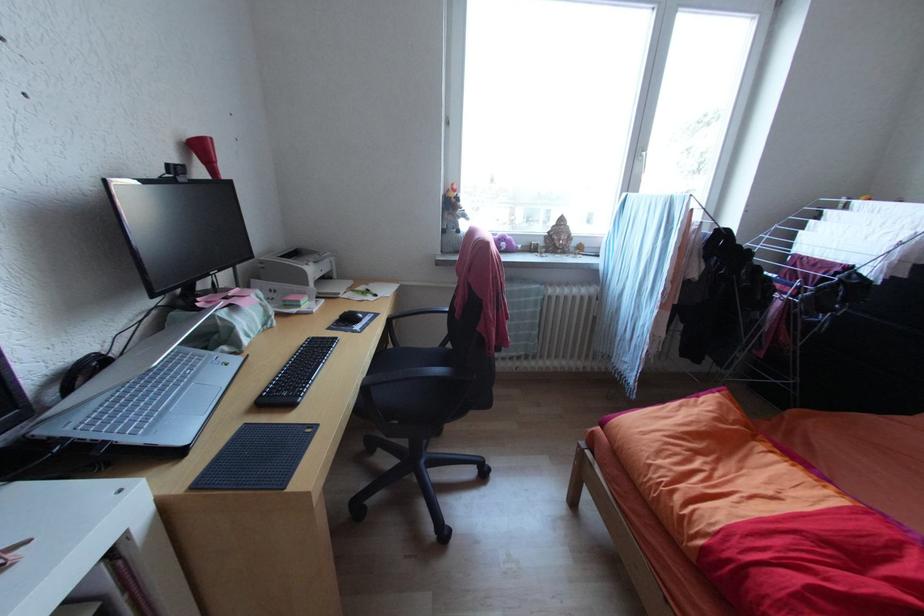
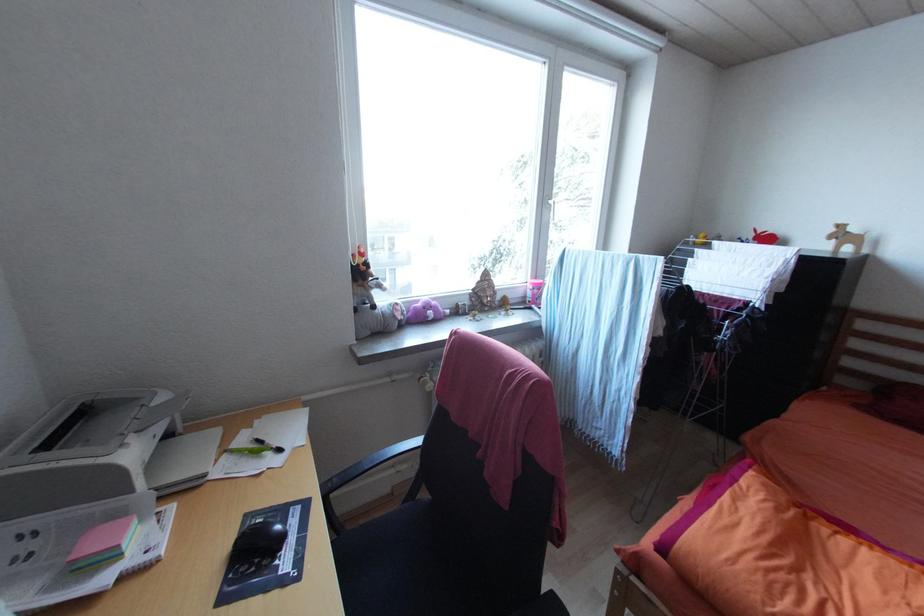
Question: The camera is either moving clockwise (left) or counter-clockwise (right) around the object. The first image is from the beginning of the video and the second image is from the end. Is the camera moving left or right when shooting the video?

Choices:
 (A) Left
 (B) Right

Answer: (A)